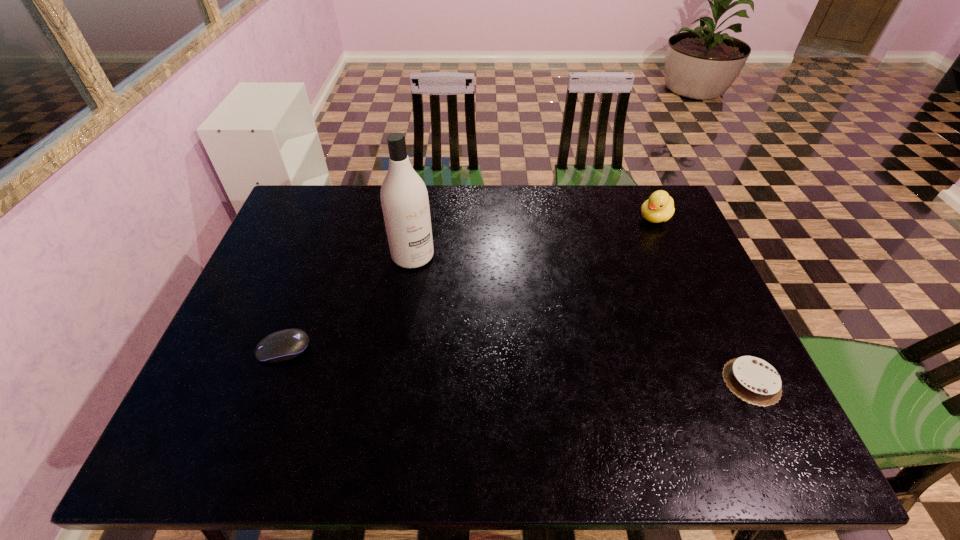
Identify the location of free space located on the beak of the duckling. (579, 283).

This screenshot has height=540, width=960. I want to click on vacant region located 0.140m on the beak of the duckling, so click(x=622, y=246).

Find the location of a particular element. The height and width of the screenshot is (540, 960). blank space located on the front-facing side of the tallest object is located at coordinates tap(495, 357).

Where is `free space located 0.110m on the front-facing side of the tallest object`? The image size is (960, 540). free space located 0.110m on the front-facing side of the tallest object is located at coordinates click(443, 293).

Image resolution: width=960 pixels, height=540 pixels. Find the location of `vacant space located 0.280m on the front-facing side of the tallest object`. vacant space located 0.280m on the front-facing side of the tallest object is located at coordinates (477, 334).

This screenshot has width=960, height=540. In order to click on object located in the far edge section of the desktop in this screenshot , I will do click(x=659, y=207).

The width and height of the screenshot is (960, 540). Identify the location of object that is at the near edge. (753, 380).

Where is `object at the left edge`? Image resolution: width=960 pixels, height=540 pixels. object at the left edge is located at coordinates (287, 344).

Locate an element on the screen. chocolate cake that is positioned at the right edge is located at coordinates (753, 380).

What are the coordinates of `duckling present at the right edge` in the screenshot? It's located at (659, 207).